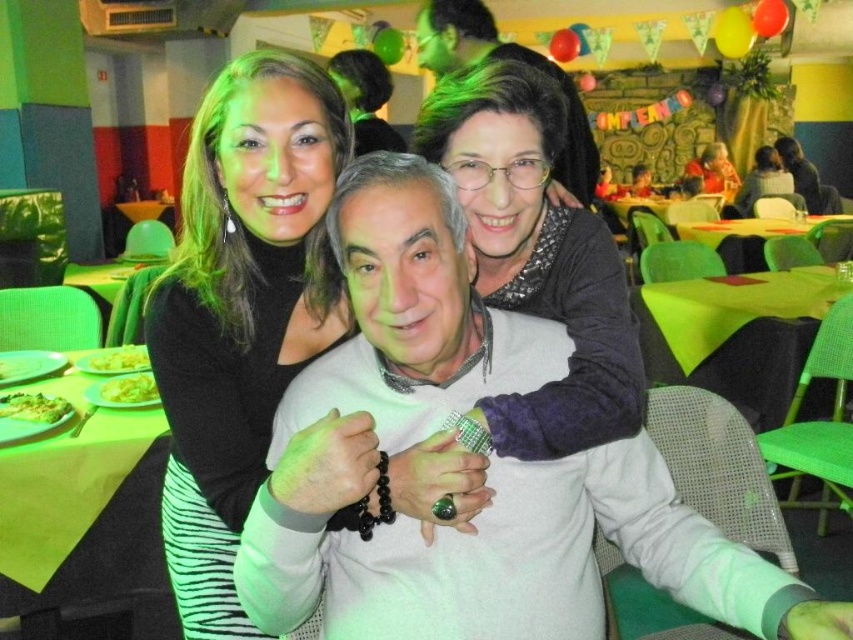
This screenshot has width=853, height=640. What do you see at coordinates (33, 406) in the screenshot?
I see `green matte pizza at lower left` at bounding box center [33, 406].

Where is `green matte pizza at lower left`? This screenshot has height=640, width=853. green matte pizza at lower left is located at coordinates (33, 406).

Find the location of a particular element. Image resolution: width=853 pixels, height=640 pixels. green matte pizza at lower left is located at coordinates (33, 406).

Which of these two, matte black sweater at center or black matte dress at center, stands shorter?

matte black sweater at center

Does matte black sweater at center lie in front of black matte dress at center?

Yes.

Where is `matte black sweater at center`? The height and width of the screenshot is (640, 853). matte black sweater at center is located at coordinates (514, 560).

Between yellow matte pasta at left and yellow matte pasta at center, which one has less height?

yellow matte pasta at left

Does point (155, 396) come closer to viewer compared to point (119, 362)?

Yes, it is.

Is point (138, 392) positioned behind point (97, 371)?

No, it is in front of (97, 371).

Locate an element on the screen. This screenshot has height=640, width=853. yellow matte pasta at left is located at coordinates (129, 388).